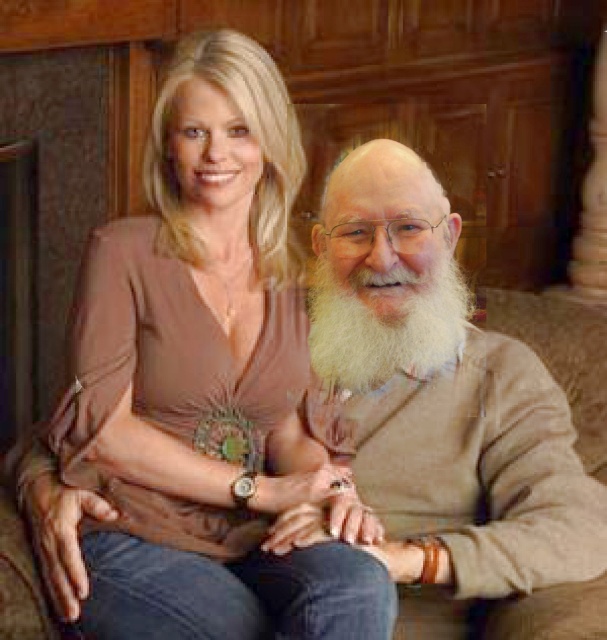
Does matte brown blouse at center appear under white fluffy beard at center?

Yes, matte brown blouse at center is below white fluffy beard at center.

How far apart are matte brown blouse at center and white fluffy beard at center?

matte brown blouse at center is 11.98 inches from white fluffy beard at center.

You are a GUI agent. You are given a task and a screenshot of the screen. Output one action in this format:
    pyautogui.click(x=<x>, y=<y>)
    Task: Click on the matte brown blouse at center
    
    Given the screenshot: What is the action you would take?
    pyautogui.click(x=211, y=381)

Who is positioned more to the left, brown fabric couch at center or white fluffy beard at center?

From the viewer's perspective, white fluffy beard at center appears more on the left side.

Is brown fabric couch at center smaller than white fluffy beard at center?

Indeed, brown fabric couch at center has a smaller size compared to white fluffy beard at center.

Does point (557, 310) come closer to viewer compared to point (337, 316)?

No.

The height and width of the screenshot is (640, 607). Find the location of `brown fabric couch at center`. brown fabric couch at center is located at coordinates (563, 355).

Does matte brown blouse at center have a larger size compared to brown fabric couch at center?

Indeed, matte brown blouse at center has a larger size compared to brown fabric couch at center.

Is matte brown blouse at center taller than brown fabric couch at center?

Yes, matte brown blouse at center is taller than brown fabric couch at center.

Which is in front, point (253, 433) or point (571, 356)?

Positioned in front is point (253, 433).

In order to click on matte brown blouse at center in this screenshot , I will do `click(211, 381)`.